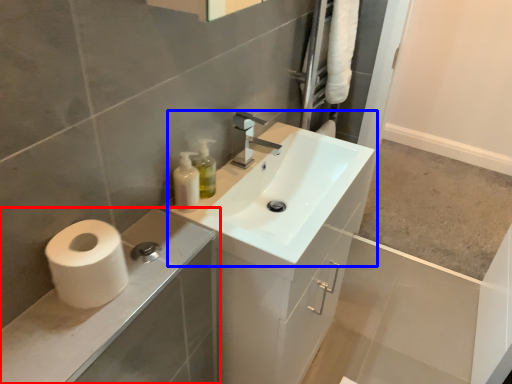
Question: Which of the following is the farthest to the observer, bathroom cabinet (highlighted by a red box) or sink (highlighted by a blue box)?

Choices:
 (A) bathroom cabinet
 (B) sink

Answer: (B)